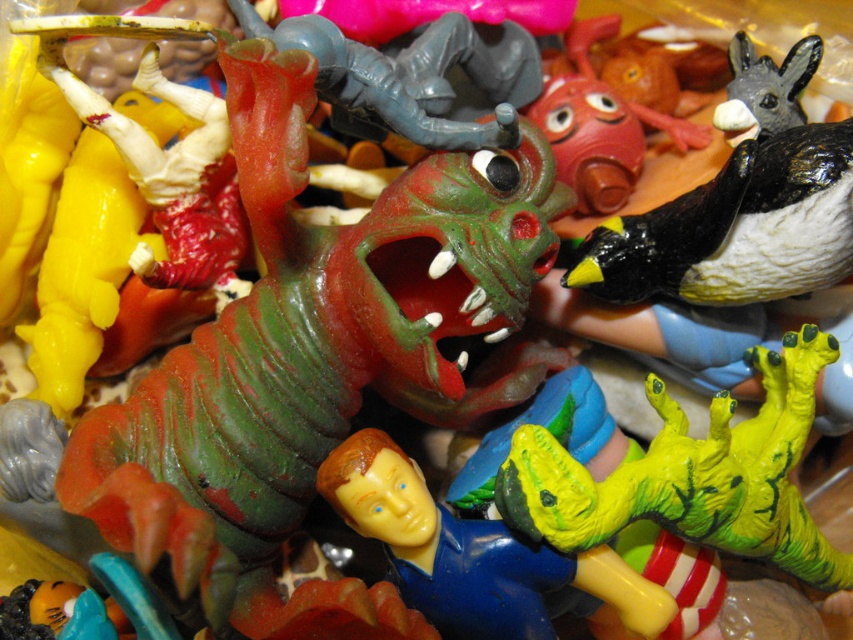
You are a child trying to place the black matte penguin at upper right and the yellow matte figure at center into a toy box. The toy box can only fit items that are narrower than 10 centimeters. Which of the two toys can definitely fit into the box?

The black matte penguin at upper right has a lesser width compared to the yellow matte figure at center. Since the toy box can only fit items narrower than 10 centimeters, the penguin is more likely to fit, but the exact width of both is unknown. However, based on the comparison, the black matte penguin at upper right has a smaller width and thus has a better chance of fitting within the 10 cm limit.

Based on the photo, looking at the scene with the colorful toy figurines, there is a shiny black bird at center and a yellow matte figure at center. Which of these two figures is taller?

The shiny black bird at center is taller than the yellow matte figure at center.